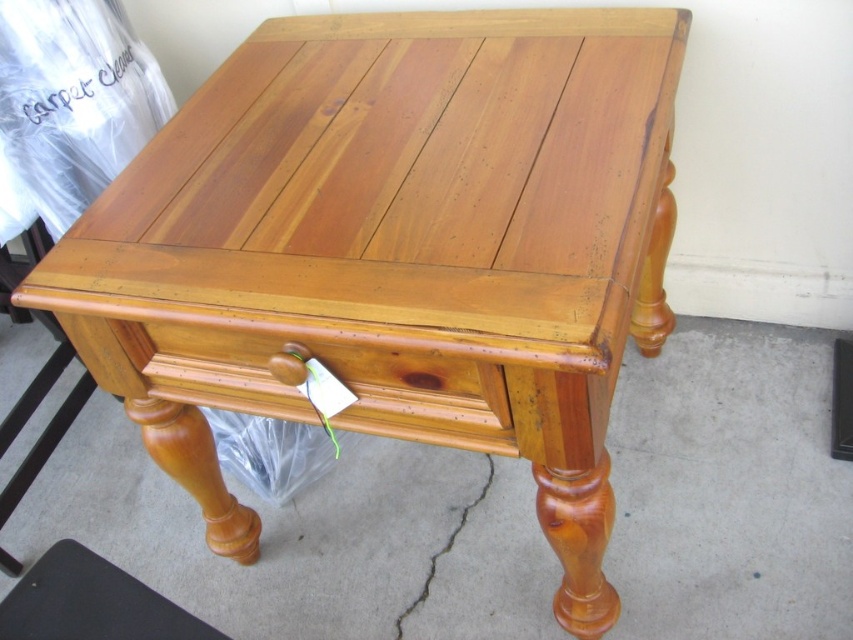
You are standing in front of the wooden coffee table and notice a point marked at coordinates (x=334, y=372). What object is located at that point?

The point at (x=334, y=372) marks the satin wood drawer at lower center.

You are organizing items on the wooden coffee table and need to place a decorative vase. The vase requires a space that is not occupied by the satin wood drawer at lower center. Where should you place the vase to avoid the drawer?

The satin wood drawer at lower center is located at point (334, 372), so you should place the vase in an area of the table surface that does not overlap with this coordinate to avoid the drawer.

You are trying to decide whether to place a small potted plant on the satin wood stool at lower left or the satin wood drawer at lower center. Based on their heights, which surface would be more stable for the plant?

The satin wood drawer at lower center is much taller than the satin wood stool at lower left, so placing the plant on the satin wood stool at lower left would be more stable as it is closer to the ground and less likely to tip over.